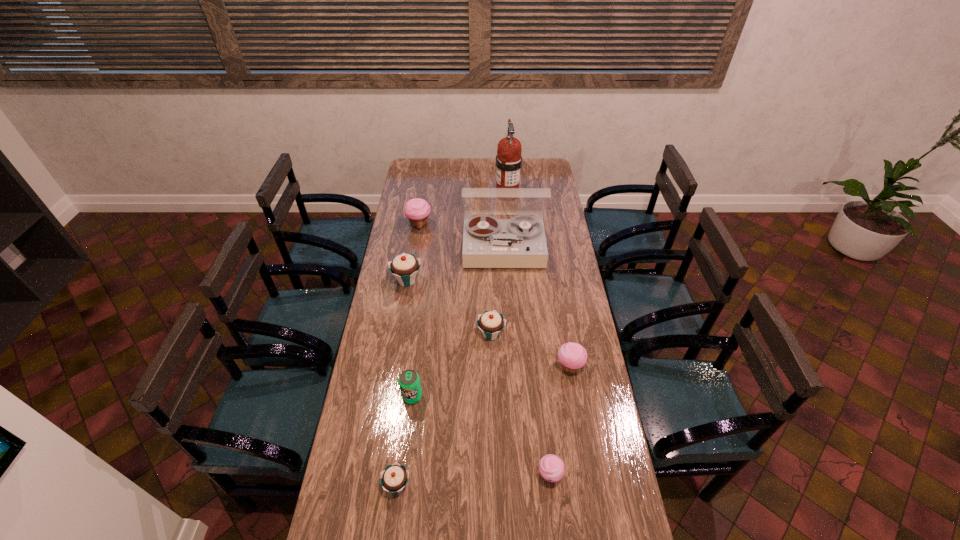
The image size is (960, 540). Find the location of `object that stands as the eighth closest to the red fire extinguisher`. object that stands as the eighth closest to the red fire extinguisher is located at coordinates (394, 478).

This screenshot has height=540, width=960. Find the location of `cupcake that can be found as the closest to the second farthest cupcake`. cupcake that can be found as the closest to the second farthest cupcake is located at coordinates (417, 210).

Where is `the sixth closest cupcake to the pop soda`? The image size is (960, 540). the sixth closest cupcake to the pop soda is located at coordinates (417, 210).

Locate which pink cupcake is the third closest to the second farthest cupcake. Please provide its 2D coordinates. Your answer should be formatted as a tuple, i.e. [(x, y)], where the tuple contains the x and y coordinates of a point satisfying the conditions above.

[(551, 468)]

Locate an element on the screen. This screenshot has height=540, width=960. the second closest pink cupcake relative to the second cupcake from right to left is located at coordinates (417, 210).

I want to click on the second closest teal cupcake to the second farthest cupcake, so (x=394, y=478).

Point out which teal cupcake is positioned as the nearest to the fifth cupcake from left to right. Please provide its 2D coordinates. Your answer should be formatted as a tuple, i.e. [(x, y)], where the tuple contains the x and y coordinates of a point satisfying the conditions above.

[(394, 478)]

Locate an element on the screen. free spot that satisfies the following two spatial constraints: 1. on the front side of the second pink cupcake from left to right; 2. on the right side of the white record player is located at coordinates (516, 476).

I want to click on free space that satisfies the following two spatial constraints: 1. on the front side of the farthest pink cupcake; 2. on the left side of the record player, so click(416, 248).